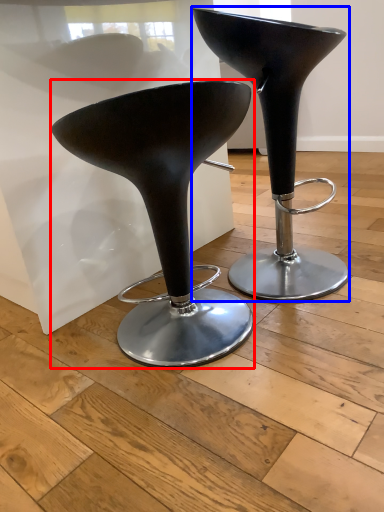
Question: Which object appears closest to the camera in this image, stool (highlighted by a red box) or stool (highlighted by a blue box)?

Choices:
 (A) stool
 (B) stool

Answer: (A)